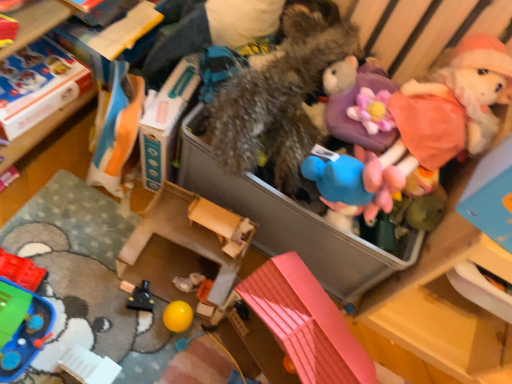
Question: In which direction should I rotate to look at pink plastic toy house at lower center, the sixth toy positioned from the left?

Choices:
 (A) right
 (B) left

Answer: (A)

Question: Does black plastic toy at lower left, the fifth toy viewed from the right, appear on the left side of pink plastic toy house at lower center, which is the third toy from right to left?

Choices:
 (A) yes
 (B) no

Answer: (A)

Question: From a real-world perspective, is black plastic toy at lower left, the fifth toy viewed from the right, on pink plastic toy house at lower center, the sixth toy positioned from the left?

Choices:
 (A) yes
 (B) no

Answer: (B)

Question: Is black plastic toy at lower left, the fifth toy viewed from the right, oriented away from pink plastic toy house at lower center, which is the third toy from right to left?

Choices:
 (A) yes
 (B) no

Answer: (B)

Question: Is the surface of black plastic toy at lower left, the fifth toy viewed from the right, in direct contact with pink plastic toy house at lower center, the sixth toy positioned from the left?

Choices:
 (A) no
 (B) yes

Answer: (A)

Question: Is black plastic toy at lower left, the fifth toy viewed from the right, to the right of pink plastic toy house at lower center, the sixth toy positioned from the left, from the viewer's perspective?

Choices:
 (A) yes
 (B) no

Answer: (B)

Question: Is black plastic toy at lower left, acting as the fourth toy starting from the left, aimed at pink plastic toy house at lower center, the sixth toy positioned from the left?

Choices:
 (A) no
 (B) yes

Answer: (A)

Question: Does black plastic toy at lower left, acting as the fourth toy starting from the left, contain cardboard box at upper left, which is the 1th storage box from left to right?

Choices:
 (A) yes
 (B) no

Answer: (B)

Question: Is black plastic toy at lower left, acting as the fourth toy starting from the left, next to cardboard box at upper left, which is counted as the third storage box, starting from the right?

Choices:
 (A) no
 (B) yes

Answer: (A)

Question: Considering the relative sizes of black plastic toy at lower left, acting as the fourth toy starting from the left, and cardboard box at upper left, which is counted as the third storage box, starting from the right, in the image provided, is black plastic toy at lower left, acting as the fourth toy starting from the left, wider than cardboard box at upper left, which is counted as the third storage box, starting from the right,?

Choices:
 (A) no
 (B) yes

Answer: (A)

Question: Considering the relative sizes of black plastic toy at lower left, acting as the fourth toy starting from the left, and cardboard box at upper left, which is the 1th storage box from left to right, in the image provided, is black plastic toy at lower left, acting as the fourth toy starting from the left, smaller than cardboard box at upper left, which is the 1th storage box from left to right,?

Choices:
 (A) no
 (B) yes

Answer: (B)

Question: Is black plastic toy at lower left, the fifth toy viewed from the right, taller than cardboard box at upper left, which is the 1th storage box from left to right?

Choices:
 (A) no
 (B) yes

Answer: (A)

Question: Considering the relative sizes of black plastic toy at lower left, the fifth toy viewed from the right, and cardboard box at upper left, which is the 1th storage box from left to right, in the image provided, is black plastic toy at lower left, the fifth toy viewed from the right, thinner than cardboard box at upper left, which is the 1th storage box from left to right,?

Choices:
 (A) no
 (B) yes

Answer: (B)

Question: Is orange fabric bag at upper left, acting as the 6th toy starting from the right, positioned in front of translucent plastic bricks at lower left, the 8th toy when ordered from right to left?

Choices:
 (A) yes
 (B) no

Answer: (A)